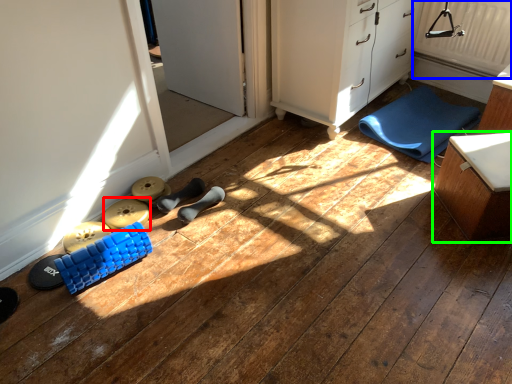
Question: Estimate the real-world distances between objects in this image. Which object is closer to toy (highlighted by a red box), radiator (highlighted by a blue box) or furniture (highlighted by a green box)?

Choices:
 (A) radiator
 (B) furniture

Answer: (B)